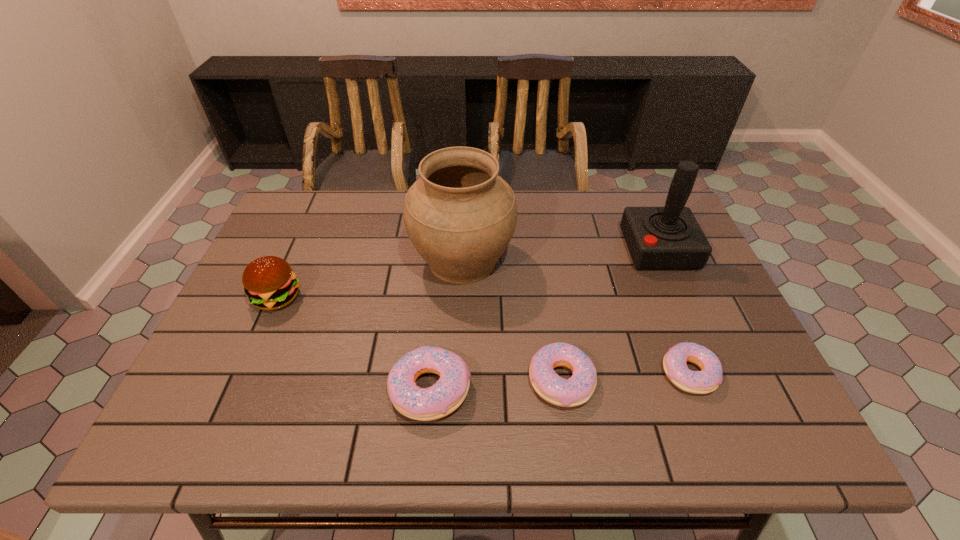
Choose which doughnut is the second nearest neighbor to the urn. Please provide its 2D coordinates. Your answer should be formatted as a tuple, i.e. [(x, y)], where the tuple contains the x and y coordinates of a point satisfying the conditions above.

[(441, 399)]

Identify which doughnut is the third nearest to the third tallest object. Please provide its 2D coordinates. Your answer should be formatted as a tuple, i.e. [(x, y)], where the tuple contains the x and y coordinates of a point satisfying the conditions above.

[(707, 380)]

This screenshot has width=960, height=540. What are the coordinates of `free space that satisfies the following two spatial constraints: 1. on the base of the joystick; 2. on the front side of the third tallest object` in the screenshot? It's located at (680, 298).

Where is `vacant region that satisfies the following two spatial constraints: 1. on the base of the joystick; 2. on the front side of the leftmost object`? The height and width of the screenshot is (540, 960). vacant region that satisfies the following two spatial constraints: 1. on the base of the joystick; 2. on the front side of the leftmost object is located at coordinates (680, 298).